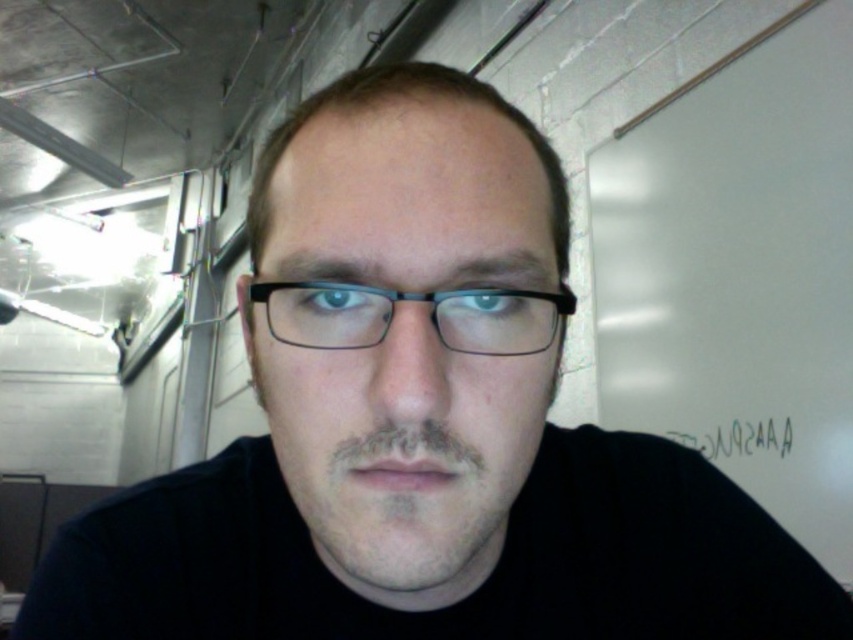
Question: Is black plastic glasses at center wider than black paper at lower right?

Choices:
 (A) yes
 (B) no

Answer: (B)

Question: From the image, what is the correct spatial relationship of black plastic glasses at center in relation to black paper at lower right?

Choices:
 (A) right
 (B) left

Answer: (B)

Question: Among these points, which one is nearest to the camera?

Choices:
 (A) (503, 506)
 (B) (453, 292)
 (C) (787, 426)

Answer: (B)

Question: Can you confirm if dark brown stubble at center is positioned above black paper at lower right?

Choices:
 (A) no
 (B) yes

Answer: (B)

Question: Which object is positioned closest to the black plastic glasses at center?

Choices:
 (A) dark brown stubble at center
 (B) black paper at lower right

Answer: (A)

Question: Estimate the real-world distances between objects in this image. Which object is farther from the black paper at lower right?

Choices:
 (A) black plastic glasses at center
 (B) dark brown stubble at center

Answer: (A)